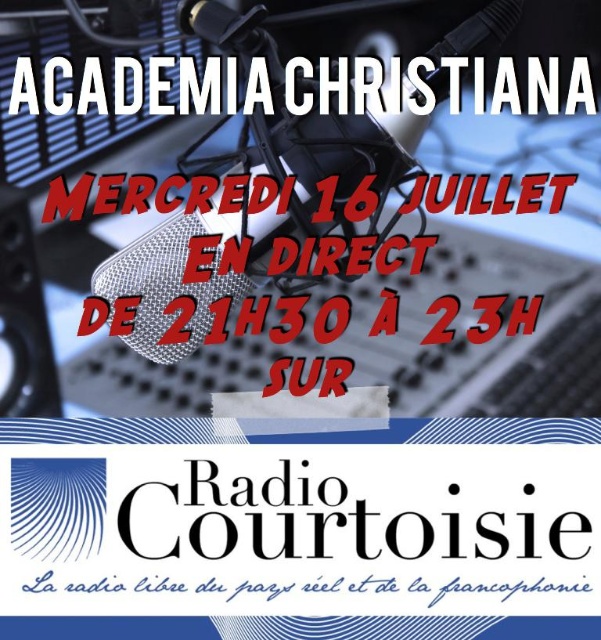
Question: Which point is closer to the camera?

Choices:
 (A) (63, 96)
 (B) (141, 592)

Answer: (B)

Question: Which point is farther to the camera?

Choices:
 (A) white metallic text at upper center
 (B) blue handwritten text at lower center

Answer: (A)

Question: From the image, what is the correct spatial relationship of white metallic text at upper center in relation to blue handwritten text at lower center?

Choices:
 (A) above
 (B) below

Answer: (A)

Question: Does white metallic text at upper center have a lesser width compared to blue handwritten text at lower center?

Choices:
 (A) no
 (B) yes

Answer: (A)

Question: Does white metallic text at upper center appear over blue handwritten text at lower center?

Choices:
 (A) yes
 (B) no

Answer: (A)

Question: Which point is farther from the camera taking this photo?

Choices:
 (A) (505, 589)
 (B) (46, 104)

Answer: (B)